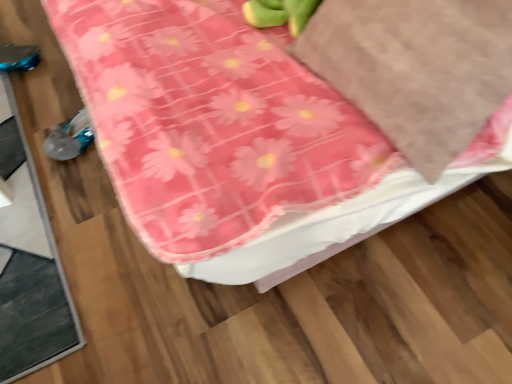
Image resolution: width=512 pixels, height=384 pixels. What do you see at coordinates (415, 68) in the screenshot?
I see `matte brown pillow at upper right` at bounding box center [415, 68].

Locate an element on the screen. The height and width of the screenshot is (384, 512). matte brown pillow at upper right is located at coordinates (415, 68).

You are a GUI agent. You are given a task and a screenshot of the screen. Output one action in this format:
    pyautogui.click(x=<x>, y=<y>)
    Task: Click on the matte brown pillow at upper right
    This screenshot has height=384, width=512.
    Given the screenshot: What is the action you would take?
    pyautogui.click(x=415, y=68)